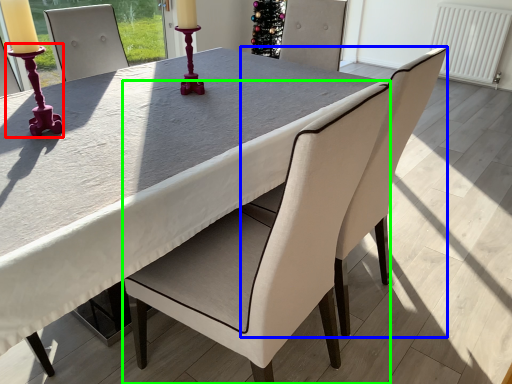
Question: Based on their relative distances, which object is farther from candle holder (highlighted by a red box)? Choose from chair (highlighted by a blue box) and chair (highlighted by a green box).

Choices:
 (A) chair
 (B) chair

Answer: (A)